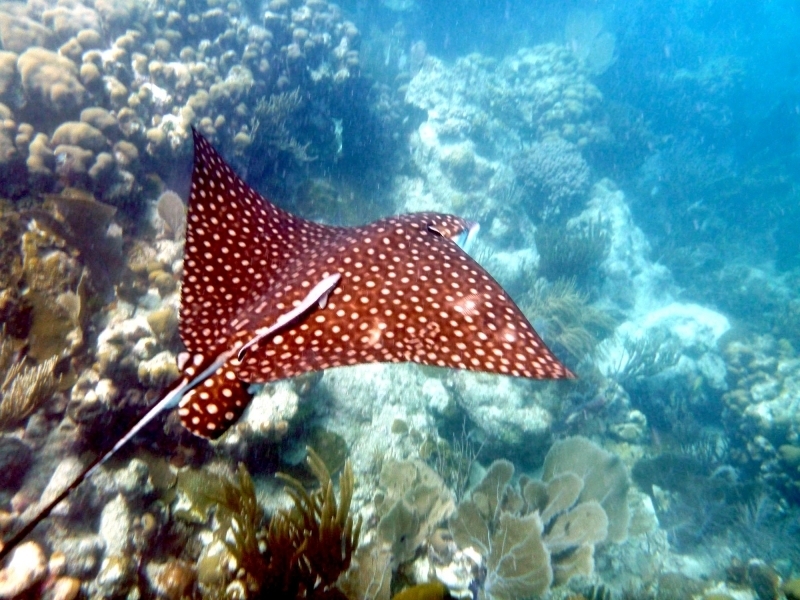
You are a GUI agent. You are given a task and a screenshot of the screen. Output one action in this format:
    pyautogui.click(x=<x>, y=<y>)
    Task: Click on the plant
    Image resolution: width=800 pixels, height=600 pixels.
    Given the screenshot: What is the action you would take?
    click(x=305, y=559)